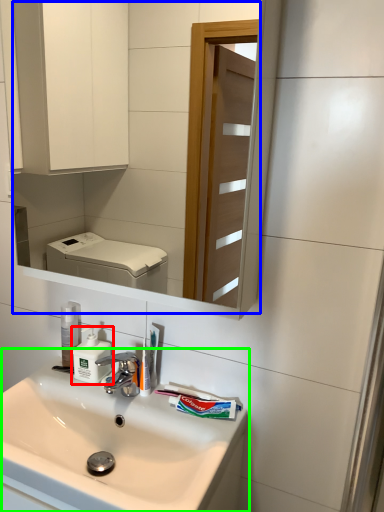
Question: Which object is positioned closest to soap dispenser (highlighted by a red box)? Select from mirror (highlighted by a blue box) and sink (highlighted by a green box).

Choices:
 (A) mirror
 (B) sink

Answer: (B)